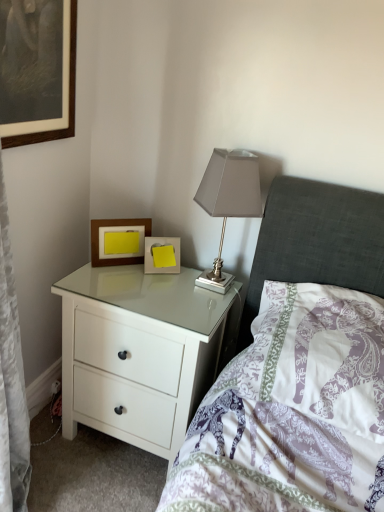
You are a GUI agent. You are given a task and a screenshot of the screen. Output one action in this format:
    pyautogui.click(x=<x>, y=<y>)
    Task: Click on the free point in front of yellow paper at center, the 3th picture frame positioned from the top
    
    Given the screenshot: What is the action you would take?
    pyautogui.click(x=154, y=292)